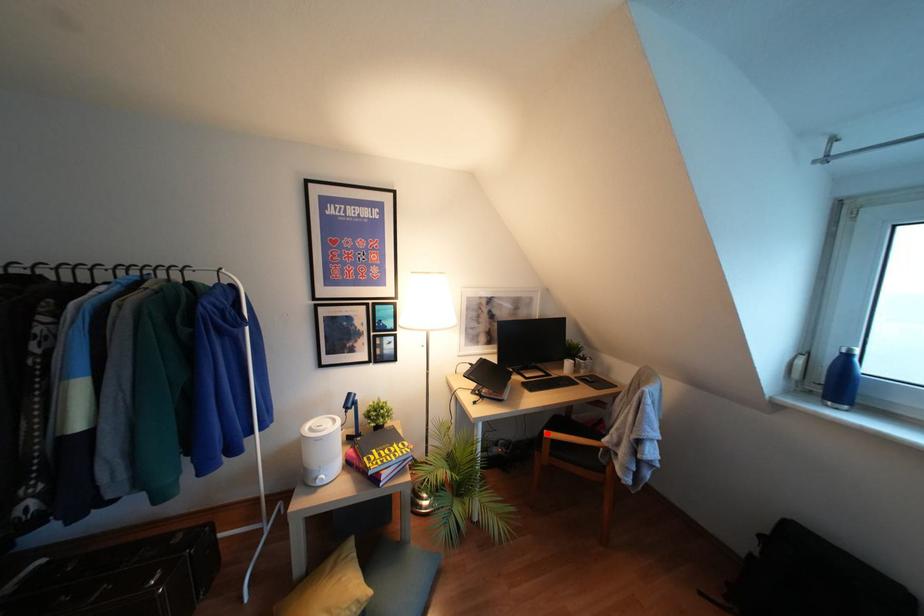
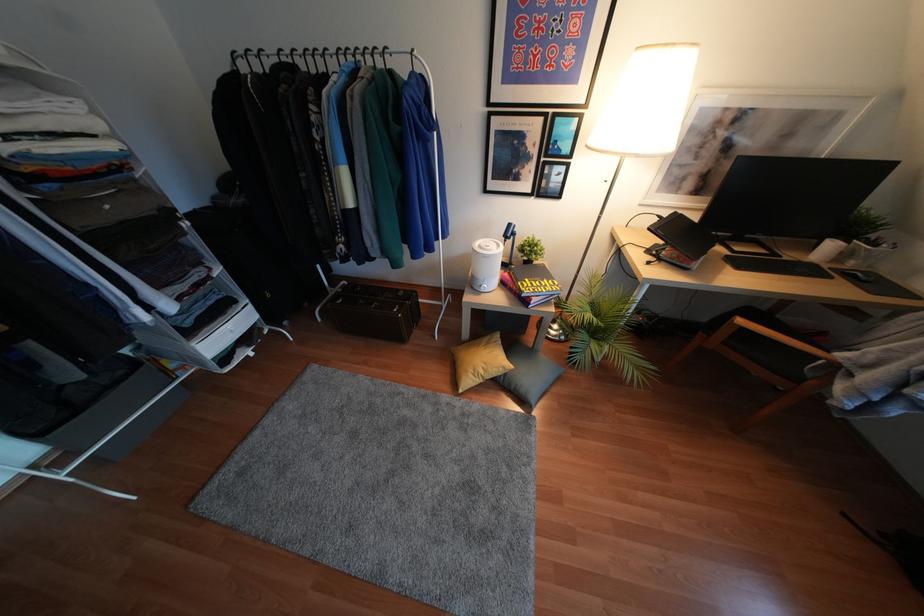
Question: I am providing you with two images of the same scene from different viewpoints. Given a red point in image1, look at the same physical point in image2. Is it:

Choices:
 (A) Closer to the viewpoint
 (B) Farther from the viewpoint

Answer: (A)